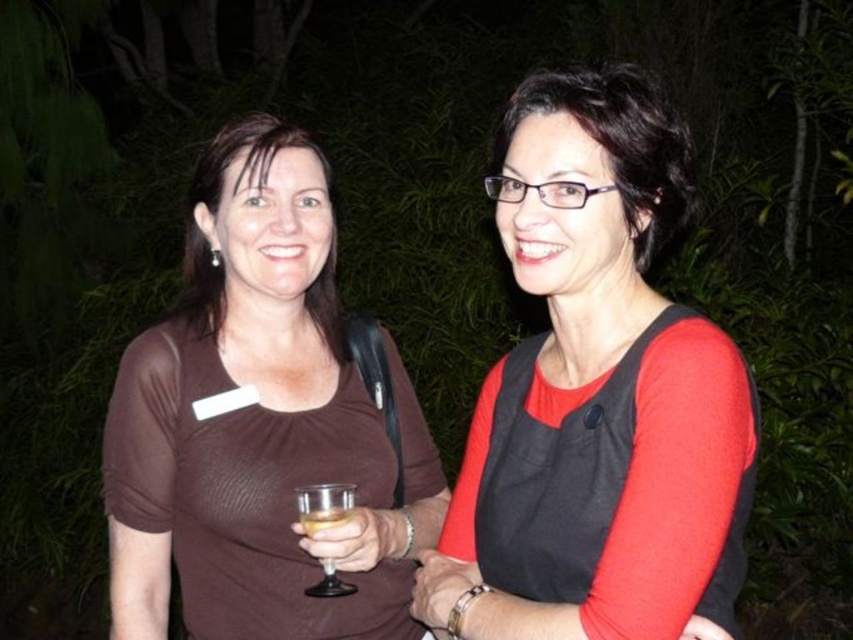
In the scene shown: In the scene, you see a brown matte shirt at center and a clear glass wine glass at center. Which object is positioned to the left of the other?

The brown matte shirt at center is to the left of the clear glass wine glass at center.

You are a photographer trying to adjust your camera focus. You notice two points in the image at coordinates point (647, 138) and point (251, 147). Which point should you focus on first if you want to ensure the closest object is sharp?

Point (647, 138) is closer to the viewer than point (251, 147), so you should focus on point (647, 138) first to ensure the closest object is sharp.